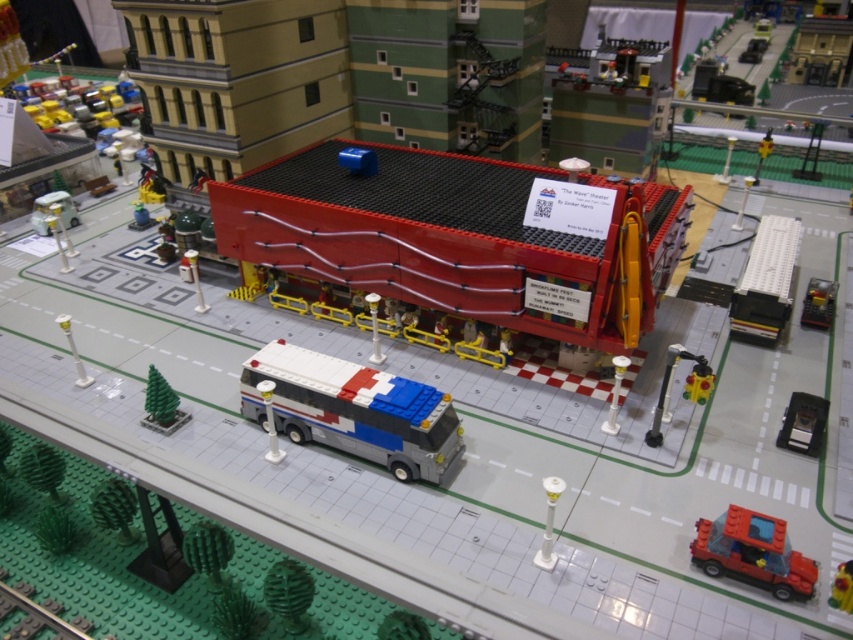
Question: Which object is positioned closest to the green rubber tree at lower left?

Choices:
 (A) translucent yellow traffic light at lower right
 (B) metallic silver phone at upper right

Answer: (A)

Question: Can you confirm if green rubber tree at lower left is positioned above yellow rubber duck at center?

Choices:
 (A) yes
 (B) no

Answer: (A)

Question: Can you confirm if brick-patterned bus at center is positioned above green rubber plant at lower center?

Choices:
 (A) no
 (B) yes

Answer: (B)

Question: Estimate the real-world distances between objects in this image. Which object is closer to the green rubber tree at lower left?

Choices:
 (A) metallic silver phone at upper right
 (B) smooth red theater at center
 (C) brick red car at lower right

Answer: (B)

Question: Can you confirm if smooth red theater at center is bigger than brick red car at lower right?

Choices:
 (A) no
 (B) yes

Answer: (B)

Question: Which object appears farthest from the camera in this image?

Choices:
 (A) smooth red theater at center
 (B) brick red theater at upper center
 (C) metallic silver phone at upper right

Answer: (B)